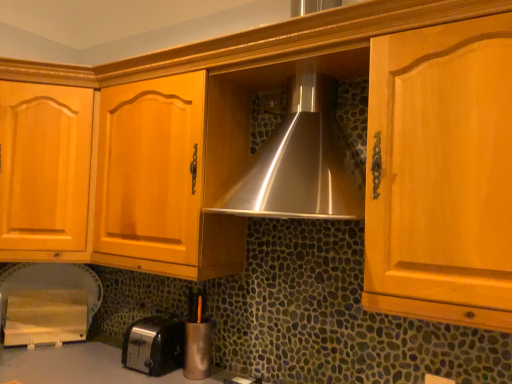
Question: Considering the relative sizes of metallic silver pen holder at lower center, which ranks as the second appliance in left-to-right order, and satin black toaster at lower left in the image provided, is metallic silver pen holder at lower center, which ranks as the second appliance in left-to-right order, bigger than satin black toaster at lower left?

Choices:
 (A) no
 (B) yes

Answer: (A)

Question: Is metallic silver pen holder at lower center, which is the second appliance in back-to-front order, next to satin black toaster at lower left and touching it?

Choices:
 (A) yes
 (B) no

Answer: (B)

Question: Can satin black toaster at lower left be found inside metallic silver pen holder at lower center, which is the second appliance in back-to-front order?

Choices:
 (A) yes
 (B) no

Answer: (B)

Question: From the image's perspective, does metallic silver pen holder at lower center, which ranks as the second appliance in left-to-right order, appear lower than satin black toaster at lower left?

Choices:
 (A) yes
 (B) no

Answer: (B)

Question: Considering the relative positions of metallic silver pen holder at lower center, which is the second appliance in back-to-front order, and satin black toaster at lower left in the image provided, is metallic silver pen holder at lower center, which is the second appliance in back-to-front order, in front of satin black toaster at lower left?

Choices:
 (A) no
 (B) yes

Answer: (A)

Question: Is metallic silver pen holder at lower center, the 1th appliance viewed from the front, inside the boundaries of wooden cutting board at lower left, which is counted as the 1th appliance, starting from the left, or outside?

Choices:
 (A) outside
 (B) inside

Answer: (A)

Question: From a real-world perspective, is metallic silver pen holder at lower center, the 1th appliance viewed from the front, physically located above or below wooden cutting board at lower left, arranged as the first appliance when viewed from the back?

Choices:
 (A) below
 (B) above

Answer: (B)

Question: In the image, is metallic silver pen holder at lower center, which is the second appliance in back-to-front order, positioned in front of or behind wooden cutting board at lower left, arranged as the first appliance when viewed from the back?

Choices:
 (A) behind
 (B) front

Answer: (B)

Question: In the image, is metallic silver pen holder at lower center, which ranks as the second appliance in left-to-right order, on the left side or the right side of wooden cutting board at lower left, arranged as the first appliance when viewed from the back?

Choices:
 (A) left
 (B) right

Answer: (B)

Question: From the image's perspective, relative to metallic silver pen holder at lower center, which is the second appliance in back-to-front order, is satin black toaster at lower left above or below?

Choices:
 (A) above
 (B) below

Answer: (B)

Question: In terms of height, does satin black toaster at lower left look taller or shorter compared to metallic silver pen holder at lower center, the 1th appliance viewed from the front?

Choices:
 (A) short
 (B) tall

Answer: (A)

Question: Which is correct: satin black toaster at lower left is inside metallic silver pen holder at lower center, the first appliance viewed from the right, or outside of it?

Choices:
 (A) inside
 (B) outside

Answer: (B)

Question: Looking at the image, does satin black toaster at lower left seem bigger or smaller compared to metallic silver pen holder at lower center, which ranks as the second appliance in left-to-right order?

Choices:
 (A) big
 (B) small

Answer: (A)

Question: From the image's perspective, is wooden cutting board at lower left, the second appliance positioned from the right, located above or below satin black toaster at lower left?

Choices:
 (A) above
 (B) below

Answer: (A)

Question: Considering the positions of wooden cutting board at lower left, arranged as the first appliance when viewed from the back, and satin black toaster at lower left in the image, is wooden cutting board at lower left, arranged as the first appliance when viewed from the back, bigger or smaller than satin black toaster at lower left?

Choices:
 (A) small
 (B) big

Answer: (B)